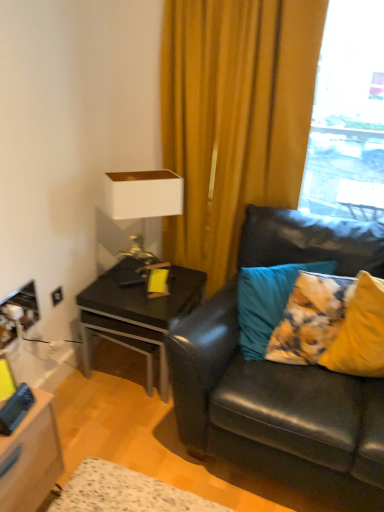
At what (x,y) coordinates should I click in order to perform the action: click on free spot above black glossy side table at left (from a real-world perspective). Please return your answer as a coordinate pair (x, y). The image size is (384, 512). Looking at the image, I should click on (144, 284).